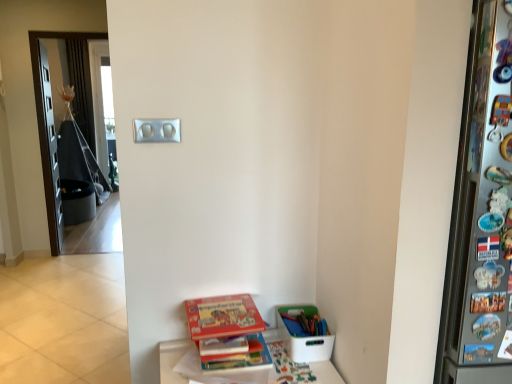
Question: Considering the relative positions of hardcover book at lower center, which ranks as the 1th book in top-to-bottom order, and silver metallic light switch at upper center in the image provided, is hardcover book at lower center, which ranks as the 1th book in top-to-bottom order, in front of silver metallic light switch at upper center?

Choices:
 (A) no
 (B) yes

Answer: (B)

Question: Is hardcover book at lower center, acting as the 2th book starting from the bottom, wider than silver metallic light switch at upper center?

Choices:
 (A) no
 (B) yes

Answer: (B)

Question: Is hardcover book at lower center, which ranks as the 1th book in top-to-bottom order, shorter than silver metallic light switch at upper center?

Choices:
 (A) no
 (B) yes

Answer: (B)

Question: From the image's perspective, does hardcover book at lower center, acting as the 2th book starting from the bottom, appear higher than silver metallic light switch at upper center?

Choices:
 (A) no
 (B) yes

Answer: (A)

Question: Is hardcover book at lower center, which ranks as the 1th book in top-to-bottom order, oriented away from silver metallic light switch at upper center?

Choices:
 (A) no
 (B) yes

Answer: (A)

Question: Considering the positions of silver metallic light switch at upper center and hardcover book at lower center, marked as the second book in a top-to-bottom arrangement, in the image, is silver metallic light switch at upper center bigger or smaller than hardcover book at lower center, marked as the second book in a top-to-bottom arrangement,?

Choices:
 (A) big
 (B) small

Answer: (B)

Question: Relative to hardcover book at lower center, the 1th book positioned from the bottom, is silver metallic light switch at upper center in front or behind?

Choices:
 (A) behind
 (B) front

Answer: (A)

Question: From the image's perspective, is silver metallic light switch at upper center positioned above or below hardcover book at lower center, the 1th book positioned from the bottom?

Choices:
 (A) below
 (B) above

Answer: (B)

Question: From their relative heights in the image, would you say silver metallic light switch at upper center is taller or shorter than hardcover book at lower center, marked as the second book in a top-to-bottom arrangement?

Choices:
 (A) tall
 (B) short

Answer: (A)

Question: Considering the positions of hardcover book at lower center, marked as the second book in a top-to-bottom arrangement, and hardcover book at lower center, acting as the 2th book starting from the bottom, in the image, is hardcover book at lower center, marked as the second book in a top-to-bottom arrangement, taller or shorter than hardcover book at lower center, acting as the 2th book starting from the bottom,?

Choices:
 (A) tall
 (B) short

Answer: (A)

Question: Looking at their shapes, would you say hardcover book at lower center, marked as the second book in a top-to-bottom arrangement, is wider or thinner than hardcover book at lower center, acting as the 2th book starting from the bottom?

Choices:
 (A) wide
 (B) thin

Answer: (B)

Question: Would you say hardcover book at lower center, the 1th book positioned from the bottom, is to the left or to the right of hardcover book at lower center, which ranks as the 1th book in top-to-bottom order, in the picture?

Choices:
 (A) left
 (B) right

Answer: (B)

Question: From a real-world perspective, is hardcover book at lower center, the 1th book positioned from the bottom, physically located above or below hardcover book at lower center, which ranks as the 1th book in top-to-bottom order?

Choices:
 (A) below
 (B) above

Answer: (A)

Question: Choose the correct answer: Is silver metallic light switch at upper center inside white plastic container at lower right or outside it?

Choices:
 (A) outside
 (B) inside

Answer: (A)

Question: Would you say silver metallic light switch at upper center is to the left or to the right of white plastic container at lower right in the picture?

Choices:
 (A) right
 (B) left

Answer: (B)